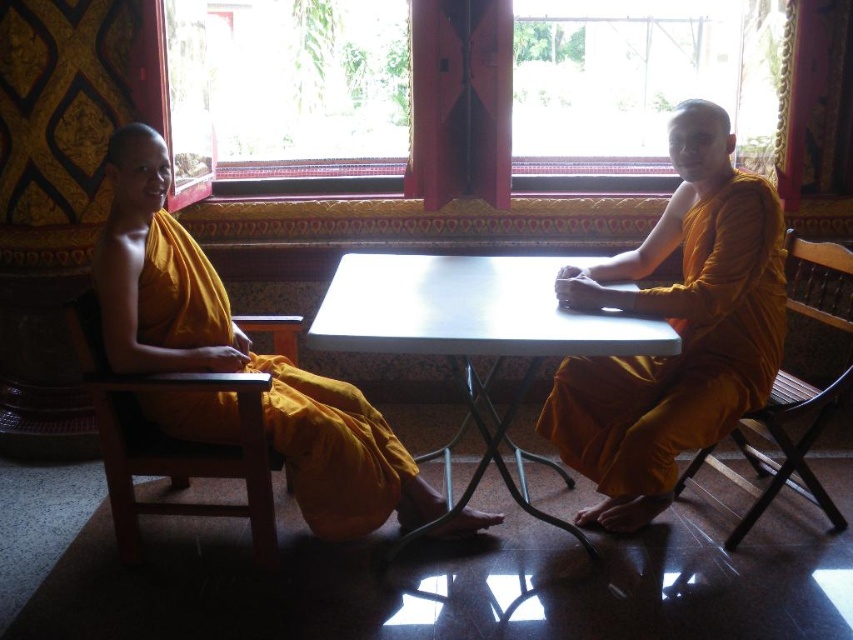
Can you confirm if white plastic table at center is smaller than wooden chair at left?

No, white plastic table at center is not smaller than wooden chair at left.

Between point (473, 291) and point (167, 456), which one is positioned behind?

Point (473, 291)

What do you see at coordinates (473, 330) in the screenshot? Image resolution: width=853 pixels, height=640 pixels. I see `white plastic table at center` at bounding box center [473, 330].

You are a GUI agent. You are given a task and a screenshot of the screen. Output one action in this format:
    pyautogui.click(x=<x>, y=<y>)
    Task: Click on the white plastic table at center
    This screenshot has height=640, width=853.
    Given the screenshot: What is the action you would take?
    pyautogui.click(x=473, y=330)

Which is below, white plastic table at center or matte yellow robe at left?

matte yellow robe at left is below.

The image size is (853, 640). I want to click on white plastic table at center, so click(x=473, y=330).

Image resolution: width=853 pixels, height=640 pixels. What are the coordinates of `white plastic table at center` in the screenshot? It's located at (x=473, y=330).

In the scene shown: Does wooden frame window at center have a smaller size compared to wooden chair at right?

Yes.

Does wooden frame window at center lie in front of wooden chair at right?

No, wooden frame window at center is behind wooden chair at right.

Is point (210, 45) in front of point (837, 248)?

That is False.

Locate an element on the screen. The width and height of the screenshot is (853, 640). wooden frame window at center is located at coordinates (288, 96).